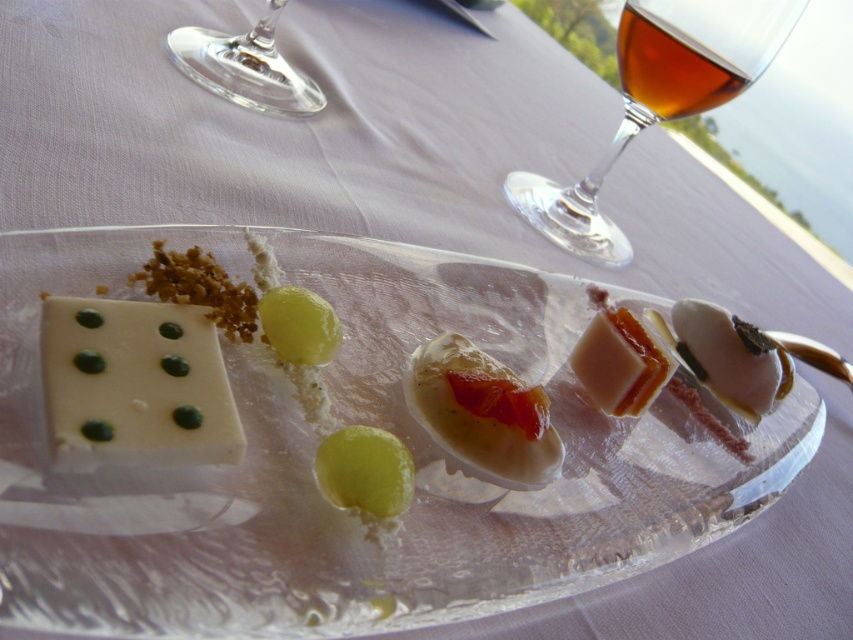
Does translucent gelatin cube at center have a larger size compared to green matte grape at center?

Yes, translucent gelatin cube at center is bigger than green matte grape at center.

Between translucent gelatin cube at center and green matte grape at center, which one appears on the right side from the viewer's perspective?

translucent gelatin cube at center

Identify the location of translucent gelatin cube at center. (621, 362).

Between white glossy platter at center and amber glass at upper right, which one appears on the right side from the viewer's perspective?

amber glass at upper right

Can you confirm if white glossy platter at center is positioned below amber glass at upper right?

Yes, white glossy platter at center is below amber glass at upper right.

Where is `white glossy platter at center`? The height and width of the screenshot is (640, 853). white glossy platter at center is located at coordinates (352, 422).

Find the location of a particular element. This screenshot has width=853, height=640. white glossy platter at center is located at coordinates (352, 422).

Who is positioned more to the right, white creamy cheese at lower left or green translucent grape at center?

green translucent grape at center is more to the right.

At what (x,y) coordinates should I click in order to perform the action: click on white creamy cheese at lower left. Please return your answer as a coordinate pair (x, y). Looking at the image, I should click on (134, 385).